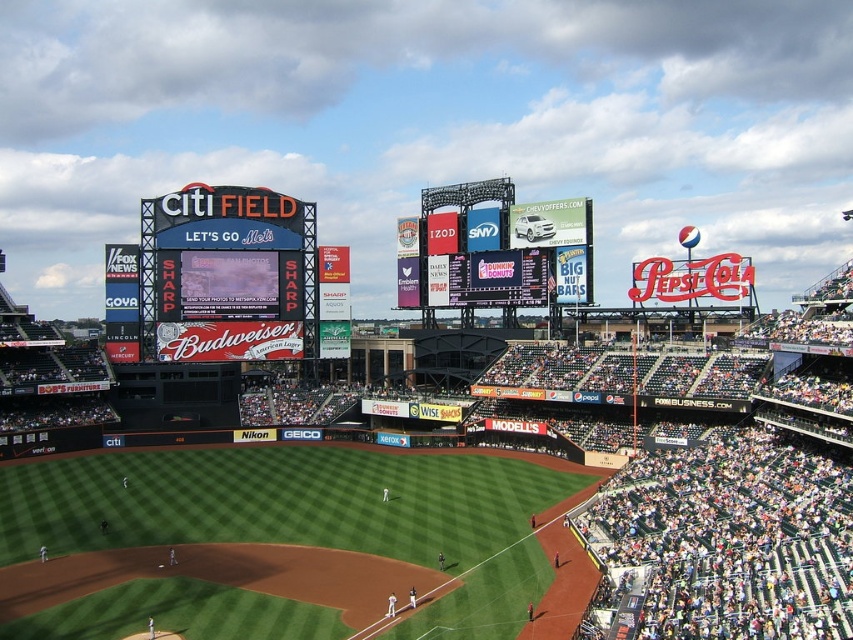
Question: Does green grass at center have a lesser width compared to blue digital scoreboard at center?

Choices:
 (A) yes
 (B) no

Answer: (B)

Question: Can you confirm if matte black scoreboard at upper left is positioned below blue digital scoreboard at center?

Choices:
 (A) yes
 (B) no

Answer: (A)

Question: Among these points, which one is nearest to the camera?

Choices:
 (A) pyautogui.click(x=181, y=288)
 (B) pyautogui.click(x=1, y=556)
 (C) pyautogui.click(x=564, y=205)

Answer: (B)

Question: Which of the following is the farthest from the observer?

Choices:
 (A) (276, 502)
 (B) (473, 285)

Answer: (B)

Question: Observing the image, what is the correct spatial positioning of matte black scoreboard at upper left in reference to blue digital scoreboard at center?

Choices:
 (A) below
 (B) above

Answer: (A)

Question: Which object appears closest to the camera in this image?

Choices:
 (A) matte black scoreboard at upper left
 (B) green grass at center

Answer: (B)